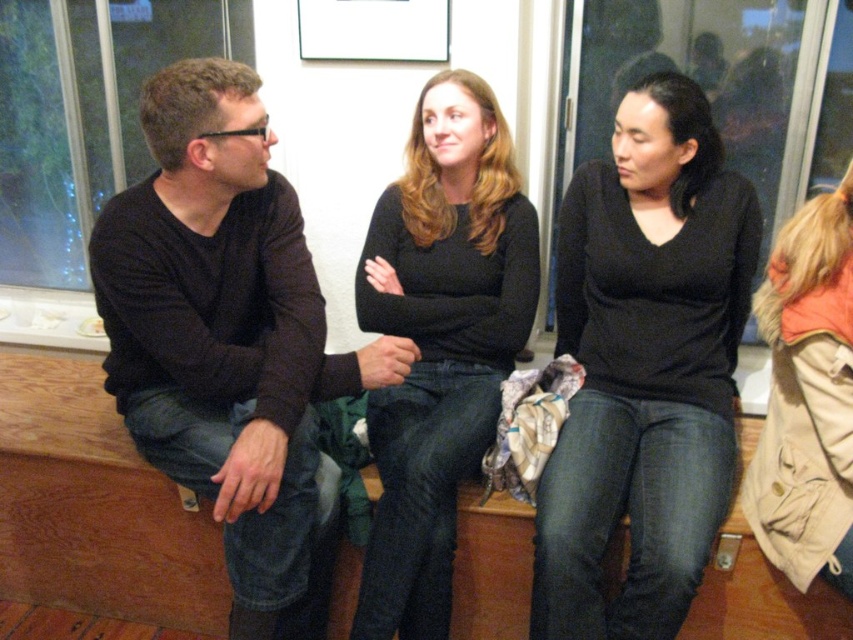
In the scene shown: You are a photographer trying to capture a candid shot of the two people wearing black matte shirts in the image. The camera you are using has a lens that can focus on objects within a 10 inch range. Can you focus on both the black matte shirt at center and the matte black shirt at center simultaneously?

The black matte shirt at center and the matte black shirt at center are 11.47 inches apart from each other. Since the camera lens can only focus within a 10 inch range, you cannot focus on both simultaneously because the distance between them exceeds the lens range.

You are standing in front of the image and want to locate the black matte sweater at left. Where is it positioned in terms of coordinates?

The black matte sweater at left is positioned at coordinates (229, 339).

You are organizing a clothing donation drive and need to categorize items by size. You have two black matte garments in front of you, one labeled as the black matte sweater at left and the other as the black matte shirt at center. Which garment should you place in the small size bin?

The black matte sweater at left should be placed in the small size bin because it has a smaller size compared to the black matte shirt at center.